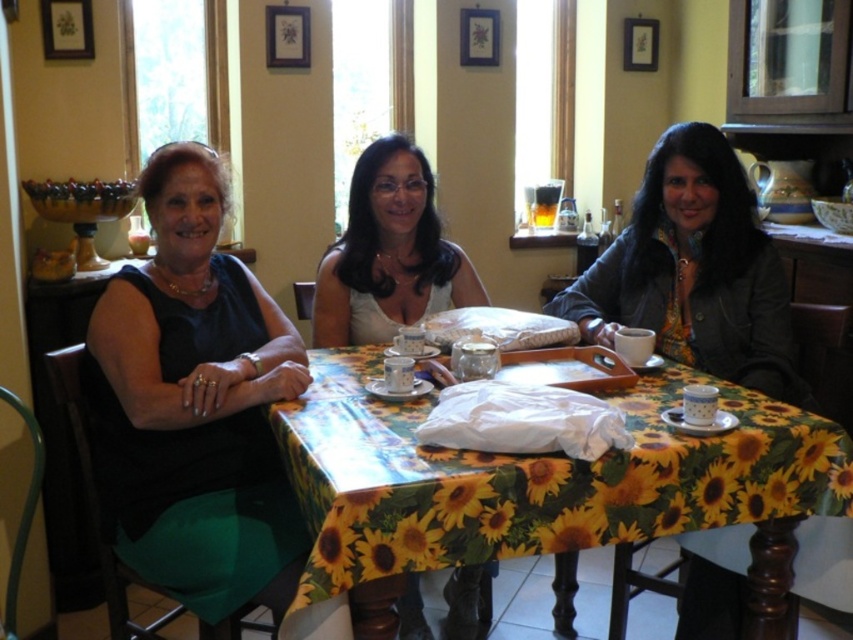
You are a guest at a dinner party and need to place a 12 inch long decorative item on the table. Given the yellow floral tablecloth at center and the leather jacket at right, which object allows enough space for the item?

The yellow floral tablecloth at center is shorter than the leather jacket at right. Since the decorative item is 12 inches long, the leather jacket at right provides more space and is suitable for placing the item.

You are a server in a cafe and need to place a 12 inch wide plate of food on the table. The table has the yellow floral tablecloth at center and the matte white blouse at center is currently on the table. Can you fit the plate between them without moving either object?

The yellow floral tablecloth at center is 20.65 inches away from the matte white blouse at center. Since the plate is 12 inches wide, there is enough space between them to place the plate without moving either object.